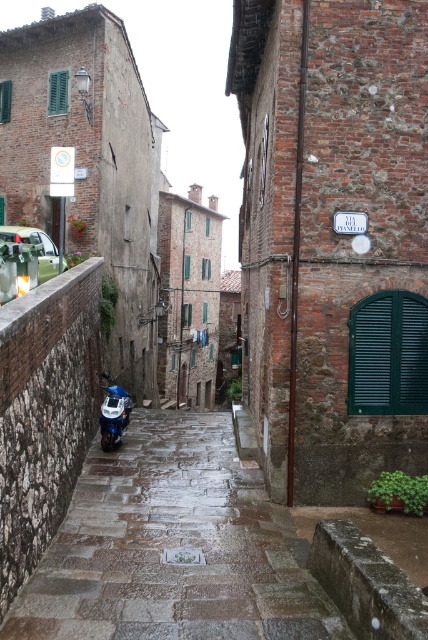
Can you confirm if rustic stone alley at center is positioned to the left of blue metallic motorcycle at lower left?

No, rustic stone alley at center is not to the left of blue metallic motorcycle at lower left.

Who is more forward, (186, 419) or (112, 403)?

Positioned in front is point (112, 403).

Which is behind, point (145, 608) or point (121, 419)?

The point (121, 419) is behind.

Find the location of a particular element. rustic stone alley at center is located at coordinates (172, 547).

Between rustic stone alley at center and metallic silver car at left, which one has less height?

rustic stone alley at center is shorter.

Is rustic stone alley at center smaller than metallic silver car at left?

No.

The width and height of the screenshot is (428, 640). What do you see at coordinates (172, 547) in the screenshot?
I see `rustic stone alley at center` at bounding box center [172, 547].

Where is `rustic stone alley at center`? The width and height of the screenshot is (428, 640). rustic stone alley at center is located at coordinates (172, 547).

Is blue metallic motorcycle at lower left positioned at the back of metallic silver car at left?

No, it is in front of metallic silver car at left.

Does blue metallic motorcycle at lower left appear on the left side of metallic silver car at left?

No, blue metallic motorcycle at lower left is not to the left of metallic silver car at left.

Image resolution: width=428 pixels, height=640 pixels. Find the location of `blue metallic motorcycle at lower left`. blue metallic motorcycle at lower left is located at coordinates pyautogui.click(x=113, y=416).

This screenshot has height=640, width=428. Identify the location of blue metallic motorcycle at lower left. (113, 416).